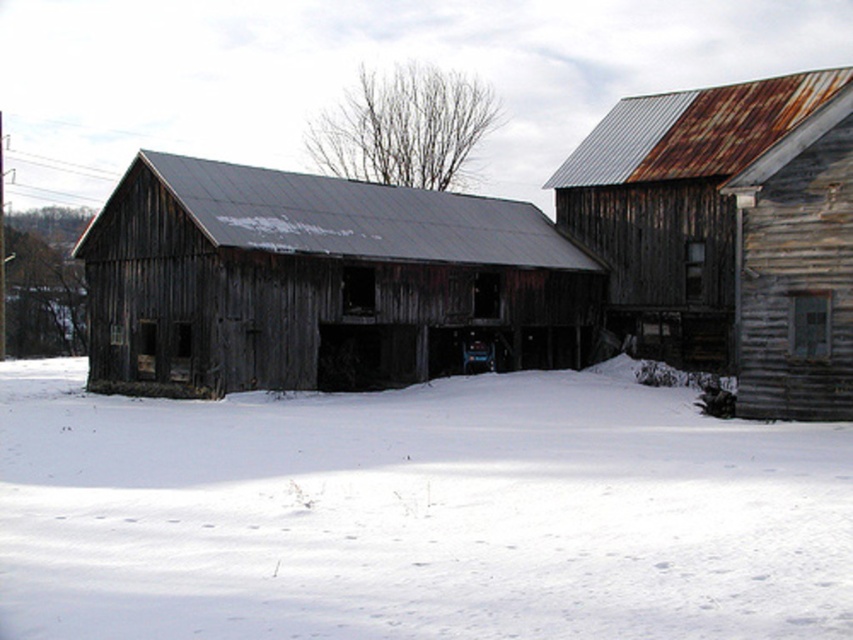
You are standing at the center of the snow field between the two buildings. You see two points marked on the ground. One is labeled as point (625, 586) and the other as point (656, 330). Which point is closer to you?

Point (625, 586) is in front of point (656, 330), so it is closer to you.

Based on the photo, you are standing in the middle of the snow between the two buildings. You see two points marked in the image, point 1 at coordinates point (132, 253) and point 2 at coordinates point (822, 362). Which point is closer to you?

Point 1 at coordinates point (132, 253) is closer to you because it is further to the camera than point 2 at coordinates point (822, 362).

You are standing in the middle of the snow and want to walk to the barn. Which direction should you go to reach the rusty wood barn at center from the white powdery snow at center?

The white powdery snow at center is closer to the viewer than the rusty wood barn at center, so you should walk away from your current position towards the direction where the rusty wood barn at center is located to reach it.